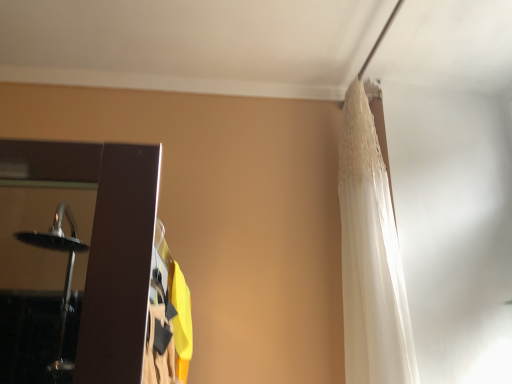
Question: Is the surface of white lace curtain at upper right, which is the 2th curtain in right-to-left order, in direct contact with white lace curtain at upper right, the second curtain positioned from the left?

Choices:
 (A) yes
 (B) no

Answer: (B)

Question: Is white lace curtain at upper right, which is the first curtain from left to right, outside of white lace curtain at upper right, the 1th curtain from the right?

Choices:
 (A) no
 (B) yes

Answer: (B)

Question: Does white lace curtain at upper right, which is the first curtain from left to right, have a greater height compared to white lace curtain at upper right, the 1th curtain from the right?

Choices:
 (A) no
 (B) yes

Answer: (A)

Question: From a real-world perspective, is white lace curtain at upper right, which is the first curtain from left to right, over white lace curtain at upper right, the second curtain positioned from the left?

Choices:
 (A) no
 (B) yes

Answer: (A)

Question: Considering the relative positions of white lace curtain at upper right, which is the 2th curtain in right-to-left order, and white lace curtain at upper right, the 1th curtain from the right, in the image provided, is white lace curtain at upper right, which is the 2th curtain in right-to-left order, behind white lace curtain at upper right, the 1th curtain from the right,?

Choices:
 (A) yes
 (B) no

Answer: (B)

Question: Is white lace curtain at upper right, which is the first curtain from left to right, positioned in front of white lace curtain at upper right, the second curtain positioned from the left?

Choices:
 (A) yes
 (B) no

Answer: (A)

Question: Is white lace curtain at upper right, the second curtain positioned from the left, oriented towards white lace curtain at upper right, which is the first curtain from left to right?

Choices:
 (A) no
 (B) yes

Answer: (B)

Question: Does white lace curtain at upper right, the 1th curtain from the right, have a smaller size compared to white lace curtain at upper right, which is the 2th curtain in right-to-left order?

Choices:
 (A) no
 (B) yes

Answer: (A)

Question: Does white lace curtain at upper right, the 1th curtain from the right, appear on the right side of white lace curtain at upper right, which is the first curtain from left to right?

Choices:
 (A) no
 (B) yes

Answer: (B)

Question: Is white lace curtain at upper right, the 1th curtain from the right, bigger than white lace curtain at upper right, which is the first curtain from left to right?

Choices:
 (A) yes
 (B) no

Answer: (A)

Question: Considering the relative sizes of white lace curtain at upper right, the 1th curtain from the right, and white lace curtain at upper right, which is the first curtain from left to right, in the image provided, is white lace curtain at upper right, the 1th curtain from the right, shorter than white lace curtain at upper right, which is the first curtain from left to right,?

Choices:
 (A) yes
 (B) no

Answer: (B)

Question: From the image's perspective, is white lace curtain at upper right, the 1th curtain from the right, located beneath white lace curtain at upper right, which is the 2th curtain in right-to-left order?

Choices:
 (A) yes
 (B) no

Answer: (B)

Question: Considering their positions, is white lace curtain at upper right, which is the 2th curtain in right-to-left order, located in front of or behind white lace curtain at upper right, the second curtain positioned from the left?

Choices:
 (A) behind
 (B) front

Answer: (B)